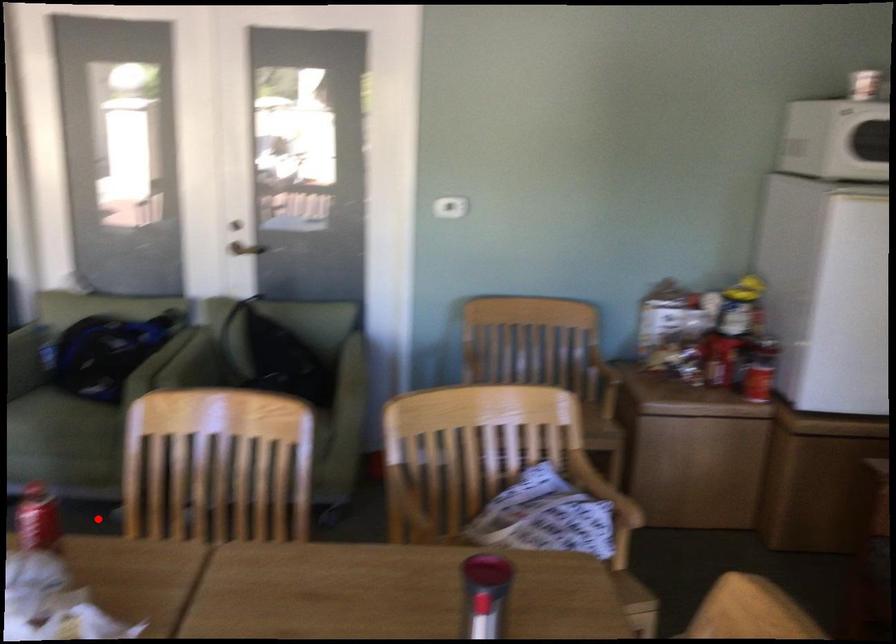
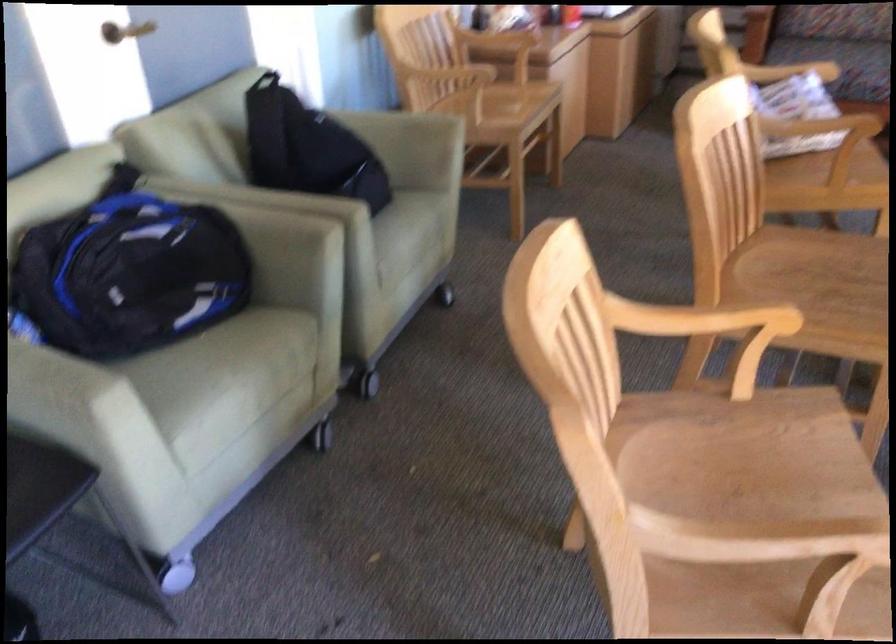
Find the pixel in the second image that matches the highlighted location in the first image.

(321, 435)